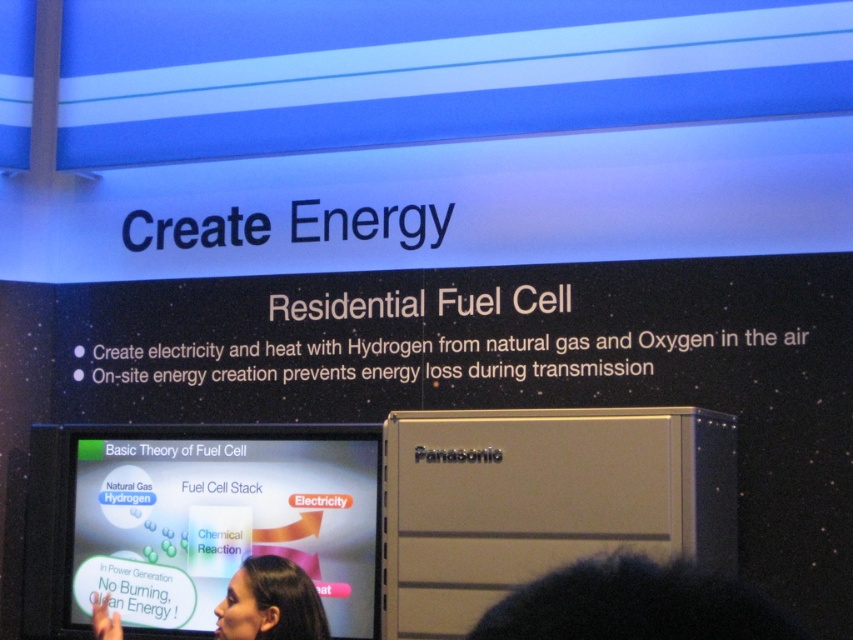
Question: Does matte white screen at center appear over smooth skin face at lower center?

Choices:
 (A) no
 (B) yes

Answer: (A)

Question: Does matte white screen at center come in front of smooth skin face at lower center?

Choices:
 (A) yes
 (B) no

Answer: (B)

Question: Which object is closer to the camera taking this photo?

Choices:
 (A) matte white screen at center
 (B) smooth skin face at lower center

Answer: (B)

Question: Does matte white screen at center have a smaller size compared to smooth skin face at lower center?

Choices:
 (A) yes
 (B) no

Answer: (B)

Question: Which point appears farthest from the camera in this image?

Choices:
 (A) click(x=270, y=580)
 (B) click(x=112, y=465)

Answer: (B)